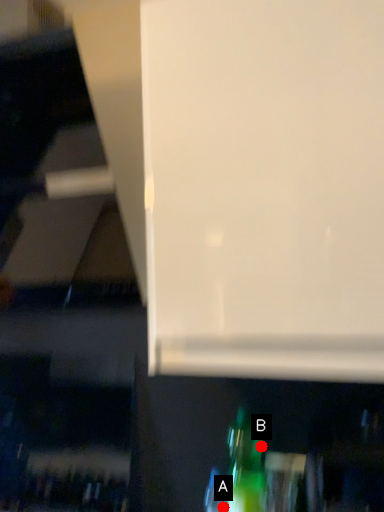
Question: Two points are circled on the image, labeled by A and B beside each circle. Which of the following is the closest to the observer?

Choices:
 (A) A is closer
 (B) B is closer

Answer: (A)